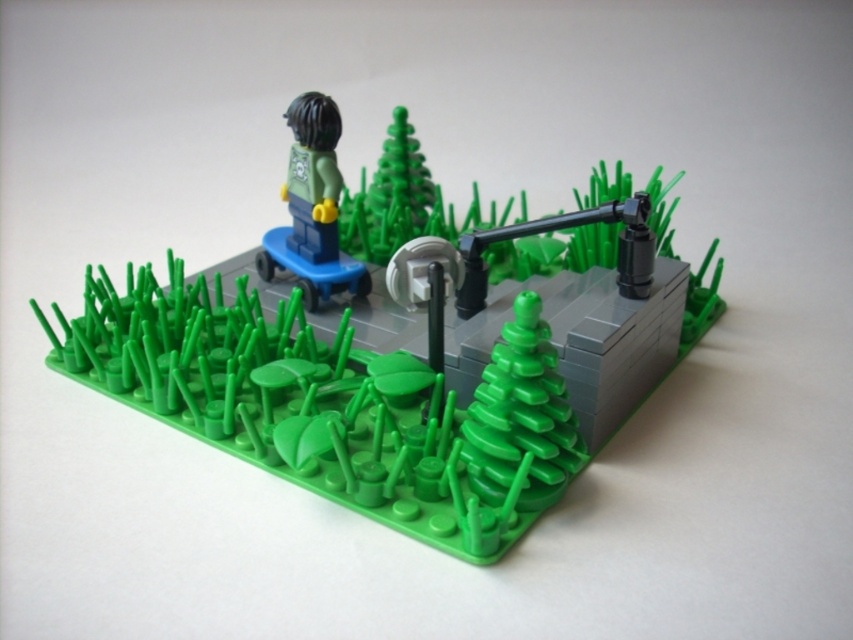
Find the location of a particular element. matte green tree at center is located at coordinates (399, 360).

Who is positioned more to the left, matte green tree at center or green matte skateboard at upper left?

Positioned to the left is green matte skateboard at upper left.

Who is more forward, (x=90, y=381) or (x=323, y=216)?

Point (x=90, y=381)

Where is `matte green tree at center`? This screenshot has width=853, height=640. matte green tree at center is located at coordinates pos(399,360).